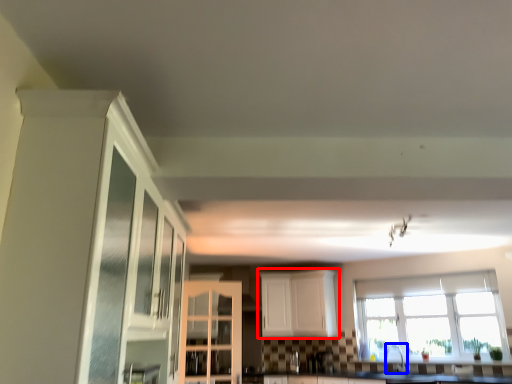
Question: Which point is further to the camera, cabinetry (highlighted by a red box) or faucet (highlighted by a blue box)?

Choices:
 (A) cabinetry
 (B) faucet

Answer: (A)